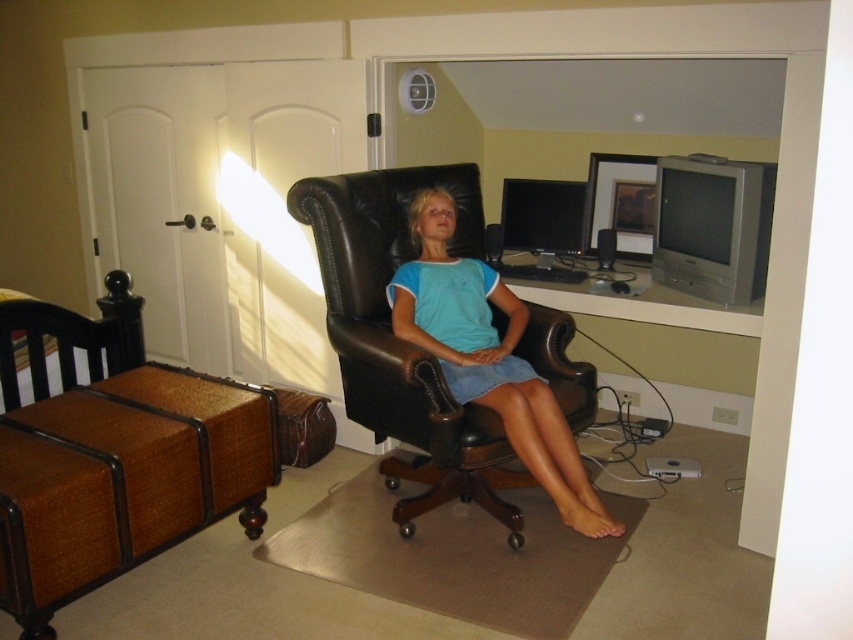
Is silver metallic television at upper right shorter than matte black monitor at upper right?

No.

Who is shorter, silver metallic television at upper right or matte black monitor at upper right?

matte black monitor at upper right is shorter.

The image size is (853, 640). I want to click on silver metallic television at upper right, so click(712, 227).

This screenshot has height=640, width=853. In order to click on silver metallic television at upper right in this screenshot , I will do `click(712, 227)`.

Which is in front, point (561, 432) or point (728, 289)?

Point (561, 432) is in front.

Who is positioned more to the right, matte blue shirt at center or silver metallic television at upper right?

From the viewer's perspective, silver metallic television at upper right appears more on the right side.

Based on the photo, who is more forward, (444, 346) or (691, 188)?

Positioned in front is point (444, 346).

Where is `matte blue shirt at center`? matte blue shirt at center is located at coordinates (489, 358).

Describe the element at coordinates (115, 458) in the screenshot. I see `brown wicker swivel chair at left` at that location.

Which is more to the left, brown wicker swivel chair at left or matte blue shirt at center?

From the viewer's perspective, brown wicker swivel chair at left appears more on the left side.

Is point (143, 484) closer to viewer compared to point (575, 499)?

Yes, point (143, 484) is closer to viewer.

Image resolution: width=853 pixels, height=640 pixels. I want to click on brown wicker swivel chair at left, so click(115, 458).